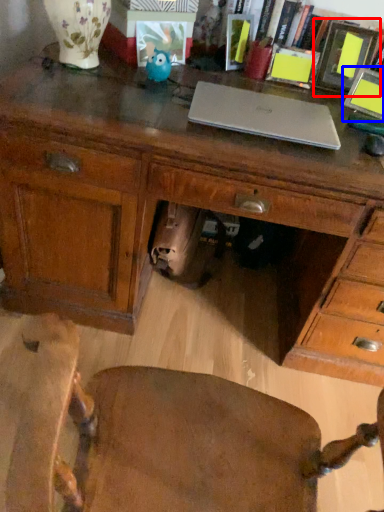
Question: Among these objects, which one is nearest to the camera, picture frame (highlighted by a red box) or picture frame (highlighted by a blue box)?

Choices:
 (A) picture frame
 (B) picture frame

Answer: (B)